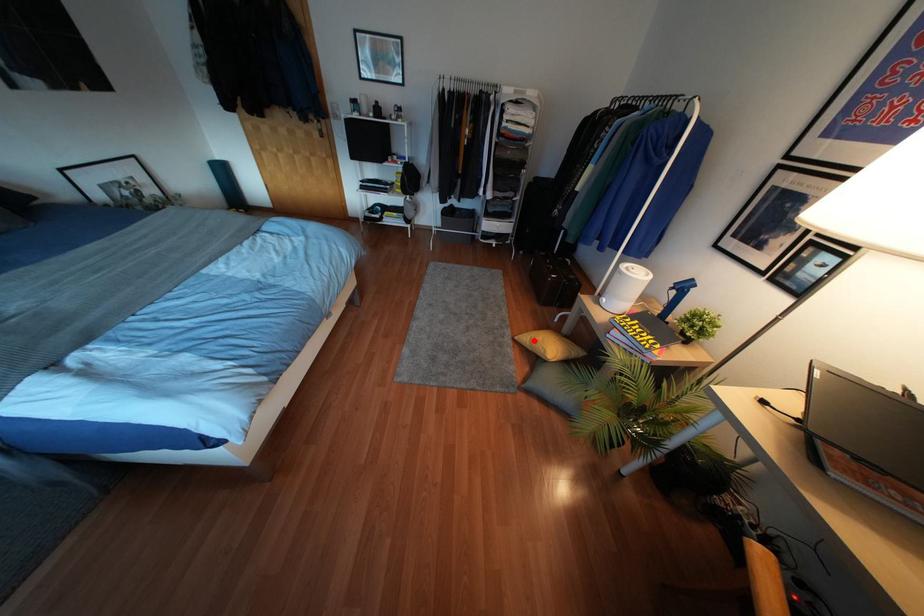
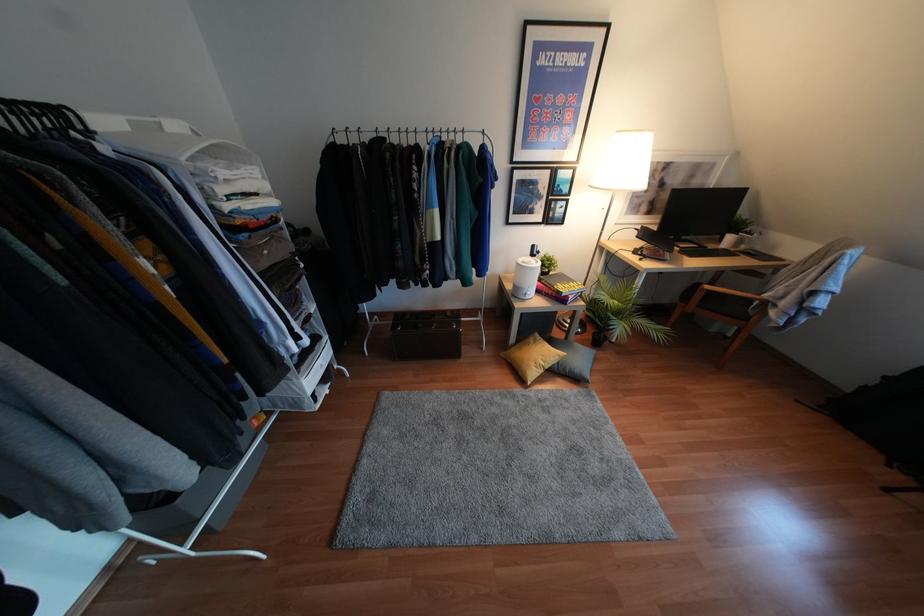
Locate, in the second image, the point that corresponds to the highlighted location in the first image.

(541, 363)